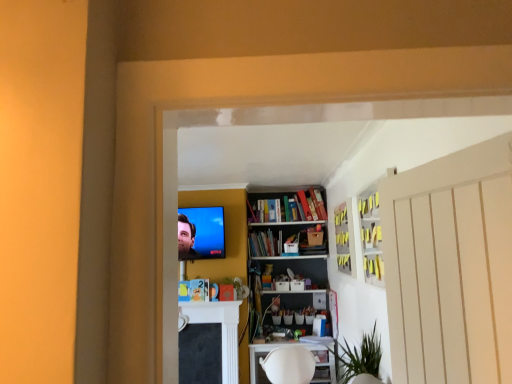
Question: Considering their positions, is white glossy cabinet at upper right, the first cabinet in the front-to-back sequence, located in front of or behind matte black tv at upper center?

Choices:
 (A) behind
 (B) front

Answer: (B)

Question: Considering the positions of white glossy cabinet at upper right, the first cabinet in the front-to-back sequence, and matte black tv at upper center in the image, is white glossy cabinet at upper right, the first cabinet in the front-to-back sequence, taller or shorter than matte black tv at upper center?

Choices:
 (A) short
 (B) tall

Answer: (B)

Question: Which object is the closest to the matte black tv at upper center?

Choices:
 (A) matte yellow book at center, placed as the second book when sorted from right to left
 (B) hardcover book at center, acting as the 1th book starting from the back
 (C) white glossy cabinet at upper right, which is the 2th cabinet in back-to-front order
 (D) green matte plant at center
 (E) yellow matte cabinet at upper center, acting as the 1th cabinet starting from the back

Answer: (A)

Question: Considering the real-world distances, which object is closest to the yellow matte cabinet at upper center, the second cabinet from the front?

Choices:
 (A) white glossy cabinet at upper right, which is the 2th cabinet in back-to-front order
 (B) matte black tv at upper center
 (C) matte yellow book at center, marked as the 1th book in a left-to-right arrangement
 (D) green matte plant at center
 (E) hardcover book at center, which is the second book in front-to-back order

Answer: (A)